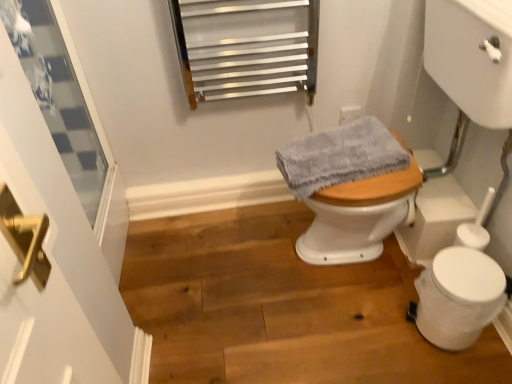
The height and width of the screenshot is (384, 512). I want to click on vacant space that is in between white glossy sink at right and white plastic toilet bowl at lower right, so click(378, 320).